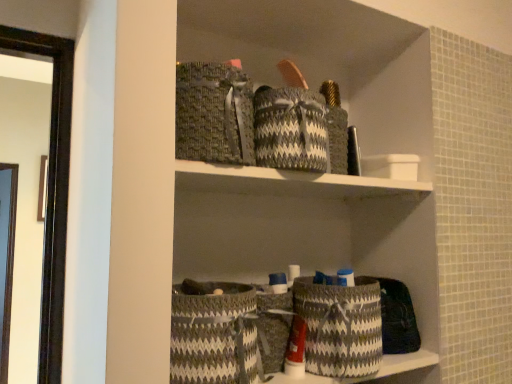
Measure the distance between point (312, 346) and camera.

The distance of point (312, 346) from camera is 31.46 inches.

Image resolution: width=512 pixels, height=384 pixels. What do you see at coordinates (340, 327) in the screenshot?
I see `gray woven basket at lower center, which is the third basket from left to right` at bounding box center [340, 327].

Where is `gray woven basket at lower center, which is the third basket from left to right`? This screenshot has height=384, width=512. gray woven basket at lower center, which is the third basket from left to right is located at coordinates (340, 327).

In the scene shown: From the image's perspective, relative to gray woven basket at lower center, the 1th basket in the right-to-left sequence, is gray woven basket at center, placed as the 2th basket when sorted from right to left, above or below?

gray woven basket at center, placed as the 2th basket when sorted from right to left, is below gray woven basket at lower center, the 1th basket in the right-to-left sequence.

Is gray woven basket at center, placed as the 2th basket when sorted from right to left, inside or outside of gray woven basket at lower center, the 1th basket in the right-to-left sequence?

The correct answer is: outside.

Does point (264, 341) come in front of point (353, 339)?

Yes, it is in front of point (353, 339).

Based on the photo, in terms of height, does gray woven basket at center, marked as the 2th basket in a left-to-right arrangement, look taller or shorter compared to gray woven basket at lower center, which is the third basket from left to right?

Clearly, gray woven basket at center, marked as the 2th basket in a left-to-right arrangement, is shorter compared to gray woven basket at lower center, which is the third basket from left to right.

Can you confirm if gray woven basket at lower center, which is the 3th basket in right-to-left order, is bigger than gray woven basket at lower center, which is the third basket from left to right?

Indeed, gray woven basket at lower center, which is the 3th basket in right-to-left order, has a larger size compared to gray woven basket at lower center, which is the third basket from left to right.

Considering the sizes of gray woven basket at lower center, placed as the first basket when sorted from left to right, and gray woven basket at lower center, the 1th basket in the right-to-left sequence, in the image, is gray woven basket at lower center, placed as the first basket when sorted from left to right, wider or thinner than gray woven basket at lower center, the 1th basket in the right-to-left sequence,?

In the image, gray woven basket at lower center, placed as the first basket when sorted from left to right, appears to be wider than gray woven basket at lower center, the 1th basket in the right-to-left sequence.

Is gray woven basket at lower center, placed as the first basket when sorted from left to right, positioned with its back to gray woven basket at lower center, which is the third basket from left to right?

gray woven basket at lower center, placed as the first basket when sorted from left to right, does not have its back to gray woven basket at lower center, which is the third basket from left to right.

Is gray woven basket at lower center, which is the 3th basket in right-to-left order, to the left of gray woven basket at center, marked as the 2th basket in a left-to-right arrangement, from the viewer's perspective?

Yes.

From a real-world perspective, is gray woven basket at lower center, which is the 3th basket in right-to-left order, positioned under gray woven basket at center, marked as the 2th basket in a left-to-right arrangement, based on gravity?

No.

Is gray woven basket at lower center, which is the 3th basket in right-to-left order, looking in the opposite direction of gray woven basket at center, placed as the 2th basket when sorted from right to left?

That's not correct — gray woven basket at lower center, which is the 3th basket in right-to-left order, is not looking away from gray woven basket at center, placed as the 2th basket when sorted from right to left.

Is gray woven basket at lower center, which is the 3th basket in right-to-left order, thinner than gray woven basket at center, placed as the 2th basket when sorted from right to left?

In fact, gray woven basket at lower center, which is the 3th basket in right-to-left order, might be wider than gray woven basket at center, placed as the 2th basket when sorted from right to left.

From the picture: Could gray woven basket at lower center, placed as the first basket when sorted from left to right, be considered to be inside gray woven basket at lower center, the 1th basket in the right-to-left sequence?

No, gray woven basket at lower center, placed as the first basket when sorted from left to right, is not a part of gray woven basket at lower center, the 1th basket in the right-to-left sequence.

From the image's perspective, would you say gray woven basket at lower center, the 1th basket in the right-to-left sequence, is positioned over gray woven basket at lower center, which is the 3th basket in right-to-left order?

No, from the image's perspective, gray woven basket at lower center, the 1th basket in the right-to-left sequence, is not over gray woven basket at lower center, which is the 3th basket in right-to-left order.

Based on their positions, is gray woven basket at lower center, the 1th basket in the right-to-left sequence, located to the left or right of gray woven basket at lower center, which is the 3th basket in right-to-left order?

gray woven basket at lower center, the 1th basket in the right-to-left sequence, is to the right of gray woven basket at lower center, which is the 3th basket in right-to-left order.

Can you see gray woven basket at lower center, which is the third basket from left to right, touching gray woven basket at lower center, placed as the first basket when sorted from left to right?

No, gray woven basket at lower center, which is the third basket from left to right, is not touching gray woven basket at lower center, placed as the first basket when sorted from left to right.

In the scene shown: Considering the relative sizes of gray woven basket at lower center, which is the third basket from left to right, and gray woven basket at center, marked as the 2th basket in a left-to-right arrangement, in the image provided, is gray woven basket at lower center, which is the third basket from left to right, taller than gray woven basket at center, marked as the 2th basket in a left-to-right arrangement,?

Yes, gray woven basket at lower center, which is the third basket from left to right, is taller than gray woven basket at center, marked as the 2th basket in a left-to-right arrangement.

From the image's perspective, is gray woven basket at lower center, the 1th basket in the right-to-left sequence, positioned above or below gray woven basket at center, marked as the 2th basket in a left-to-right arrangement?

Based on their image positions, gray woven basket at lower center, the 1th basket in the right-to-left sequence, is located above gray woven basket at center, marked as the 2th basket in a left-to-right arrangement.

I want to click on basket on the right of gray woven basket at center, placed as the 2th basket when sorted from right to left, so click(x=340, y=327).

Measure the distance from gray woven basket at lower center, the 1th basket in the right-to-left sequence, to gray woven basket at center, placed as the 2th basket when sorted from right to left.

A distance of 3.41 inches exists between gray woven basket at lower center, the 1th basket in the right-to-left sequence, and gray woven basket at center, placed as the 2th basket when sorted from right to left.

In terms of width, does gray woven basket at center, placed as the 2th basket when sorted from right to left, look wider or thinner when compared to gray woven basket at lower center, which is the 3th basket in right-to-left order?

In the image, gray woven basket at center, placed as the 2th basket when sorted from right to left, appears to be more narrow than gray woven basket at lower center, which is the 3th basket in right-to-left order.

Considering the relative positions of gray woven basket at center, marked as the 2th basket in a left-to-right arrangement, and gray woven basket at lower center, which is the 3th basket in right-to-left order, in the image provided, is gray woven basket at center, marked as the 2th basket in a left-to-right arrangement, to the left or to the right of gray woven basket at lower center, which is the 3th basket in right-to-left order,?

Clearly, gray woven basket at center, marked as the 2th basket in a left-to-right arrangement, is on the right of gray woven basket at lower center, which is the 3th basket in right-to-left order, in the image.

From the image's perspective, is gray woven basket at center, placed as the 2th basket when sorted from right to left, positioned above or below gray woven basket at lower center, placed as the first basket when sorted from left to right?

Clearly, from the image's perspective, gray woven basket at center, placed as the 2th basket when sorted from right to left, is below gray woven basket at lower center, placed as the first basket when sorted from left to right.

Between gray woven basket at center, placed as the 2th basket when sorted from right to left, and gray woven basket at lower center, placed as the first basket when sorted from left to right, which one is positioned behind?

gray woven basket at center, placed as the 2th basket when sorted from right to left, is behind.

From a real-world perspective, count 2nd baskets downward from the gray woven basket at lower center, which is the third basket from left to right, and point to it. Please provide its 2D coordinates.

[(273, 328)]

There is a gray woven basket at lower center, placed as the first basket when sorted from left to right. In order to click on the 1st basket below it (from the image's perspective) in this screenshot , I will do `click(340, 327)`.

From the image, which object appears to be nearer to gray woven basket at lower center, placed as the first basket when sorted from left to right, gray woven basket at lower center, the 1th basket in the right-to-left sequence, or gray woven basket at center, marked as the 2th basket in a left-to-right arrangement?

gray woven basket at center, marked as the 2th basket in a left-to-right arrangement.

Looking at the image, which one is located further to gray woven basket at center, placed as the 2th basket when sorted from right to left, gray woven basket at lower center, which is the 3th basket in right-to-left order, or gray woven basket at lower center, the 1th basket in the right-to-left sequence?

Among the two, gray woven basket at lower center, the 1th basket in the right-to-left sequence, is located further to gray woven basket at center, placed as the 2th basket when sorted from right to left.

Which object lies nearer to the anchor point gray woven basket at lower center, the 1th basket in the right-to-left sequence, gray woven basket at lower center, which is the 3th basket in right-to-left order, or gray woven basket at center, placed as the 2th basket when sorted from right to left?

Based on the image, gray woven basket at center, placed as the 2th basket when sorted from right to left, appears to be nearer to gray woven basket at lower center, the 1th basket in the right-to-left sequence.

Looking at the image, which one is located further to gray woven basket at lower center, which is the 3th basket in right-to-left order, gray woven basket at center, placed as the 2th basket when sorted from right to left, or gray woven basket at lower center, the 1th basket in the right-to-left sequence?

gray woven basket at lower center, the 1th basket in the right-to-left sequence, is positioned further to the anchor gray woven basket at lower center, which is the 3th basket in right-to-left order.

Looking at the image, which one is located closer to gray woven basket at center, marked as the 2th basket in a left-to-right arrangement, gray woven basket at lower center, the 1th basket in the right-to-left sequence, or gray woven basket at lower center, which is the 3th basket in right-to-left order?

gray woven basket at lower center, which is the 3th basket in right-to-left order, lies closer to gray woven basket at center, marked as the 2th basket in a left-to-right arrangement, than the other object.

Estimate the real-world distances between objects in this image. Which object is further from gray woven basket at lower center, which is the third basket from left to right, gray woven basket at center, placed as the 2th basket when sorted from right to left, or gray woven basket at lower center, placed as the first basket when sorted from left to right?

gray woven basket at lower center, placed as the first basket when sorted from left to right.

You are a GUI agent. You are given a task and a screenshot of the screen. Output one action in this format:
    pyautogui.click(x=<x>, y=<y>)
    Task: Click on the basket between gray woven basket at lower center, placed as the first basket when sorted from left to right, and gray woven basket at lower center, the 1th basket in the right-to-left sequence, from left to right
    The width and height of the screenshot is (512, 384).
    Given the screenshot: What is the action you would take?
    pyautogui.click(x=273, y=328)